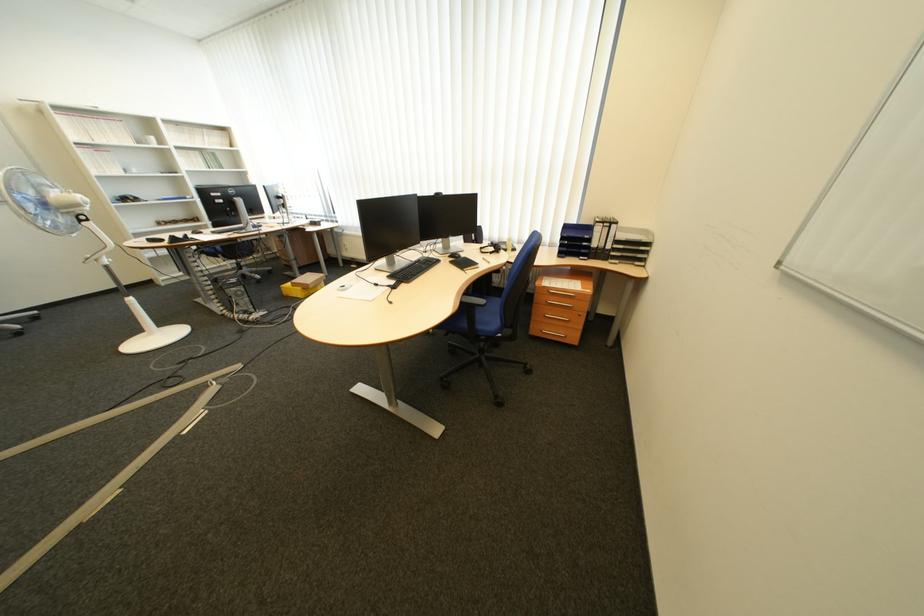
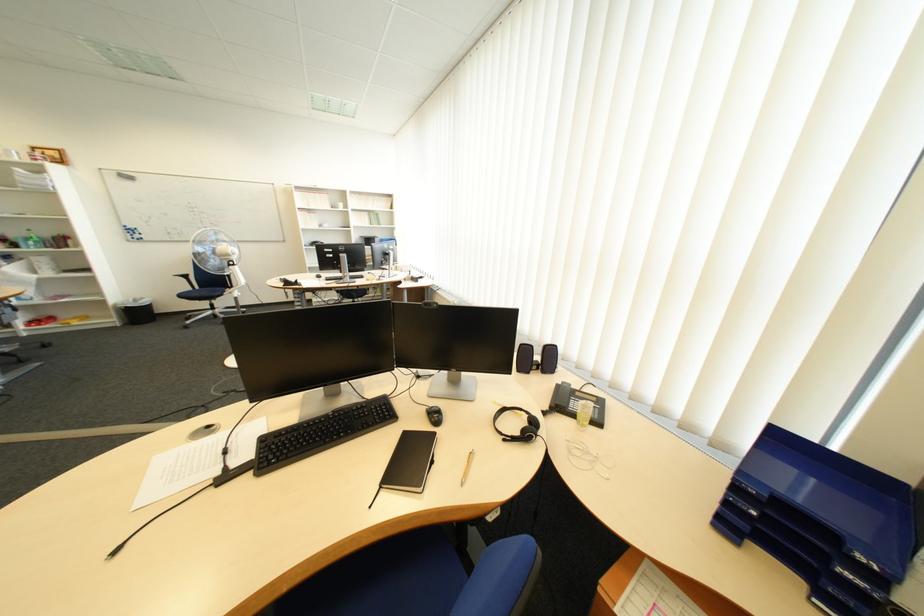
In the second image, find the point that corresponds to [579,244] in the first image.

(767, 514)